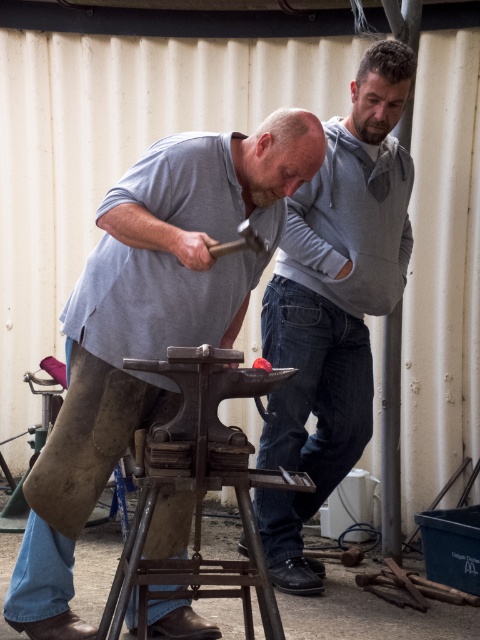
Question: Among these points, which one is nearest to the camera?

Choices:
 (A) (195, 173)
 (B) (291, 196)

Answer: (A)

Question: Is matte gray shirt at center below gray cotton shirt at upper center?

Choices:
 (A) yes
 (B) no

Answer: (A)

Question: Which of the following is the closest to the observer?

Choices:
 (A) gray cotton shirt at upper center
 (B) matte gray shirt at center

Answer: (B)

Question: Is matte gray shirt at center thinner than gray cotton shirt at upper center?

Choices:
 (A) no
 (B) yes

Answer: (A)

Question: Does matte gray shirt at center have a greater width compared to gray cotton shirt at upper center?

Choices:
 (A) yes
 (B) no

Answer: (A)